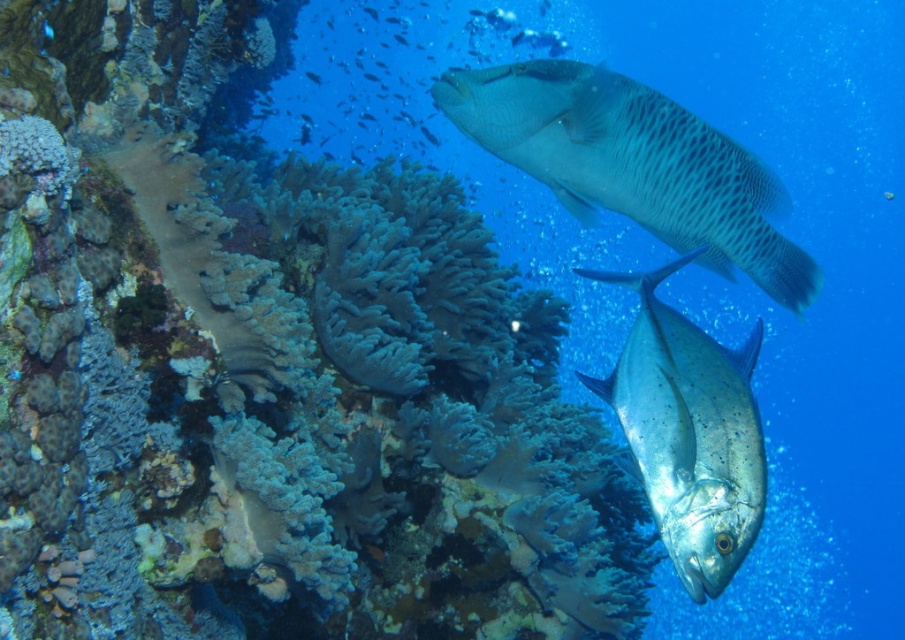
Is point (670, 244) farther from viewer compared to point (741, 378)?

Yes, point (670, 244) is behind point (741, 378).

Is point (550, 70) less distant than point (698, 365)?

No, it is not.

What do you see at coordinates (634, 163) in the screenshot? I see `speckled gray fish at upper center` at bounding box center [634, 163].

I want to click on speckled gray fish at upper center, so click(x=634, y=163).

Is point (283, 568) more distant than point (697, 371)?

Yes, point (283, 568) is farther from viewer.

Find the location of a particular element. The height and width of the screenshot is (640, 905). soft coral at center is located at coordinates (270, 371).

Who is positioned more to the left, soft coral at center or speckled gray fish at upper center?

soft coral at center is more to the left.

Consider the image. Does soft coral at center lie behind speckled gray fish at upper center?

That is False.

Between point (82, 481) and point (780, 288), which one is positioned in front?

Point (82, 481)

At what (x,y) coordinates should I click in order to perform the action: click on soft coral at center. Please return your answer as a coordinate pair (x, y). The width and height of the screenshot is (905, 640). Looking at the image, I should click on (270, 371).